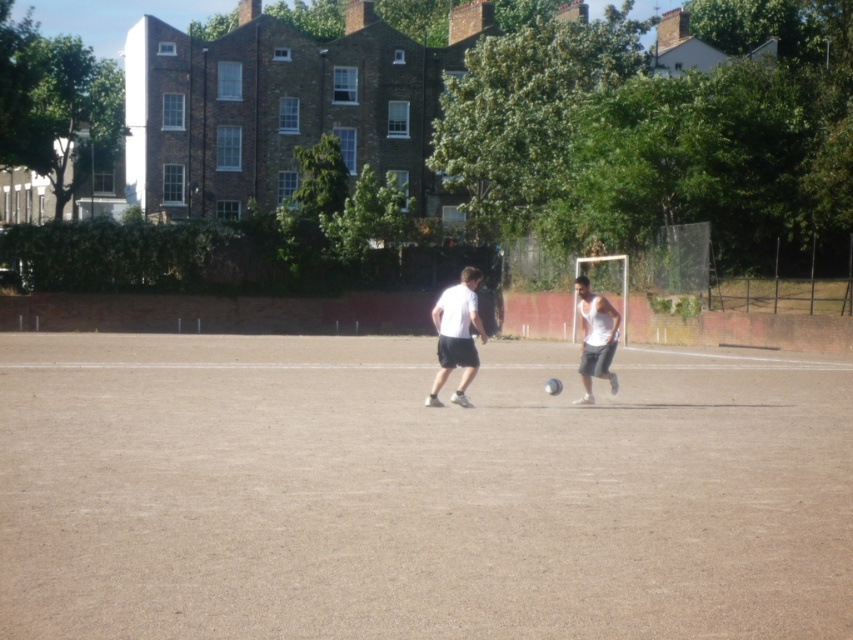
Question: Can you confirm if brown textured ground at center is thinner than white matte tank top at center?

Choices:
 (A) yes
 (B) no

Answer: (B)

Question: Which of the following is the farthest from the observer?

Choices:
 (A) white matte shorts at center
 (B) brown textured ground at center

Answer: (A)

Question: Is brown textured ground at center further to the viewer compared to white matte shorts at center?

Choices:
 (A) no
 (B) yes

Answer: (A)

Question: Which of the following is the farthest from the observer?

Choices:
 (A) brown textured ground at center
 (B) white matte shorts at center
 (C) white matte tank top at center

Answer: (C)

Question: Which point is closer to the camera taking this photo?

Choices:
 (A) (595, 328)
 (B) (636, 394)
 (C) (434, 307)

Answer: (A)

Question: Is white matte shorts at center to the right of white matte tank top at center from the viewer's perspective?

Choices:
 (A) yes
 (B) no

Answer: (B)